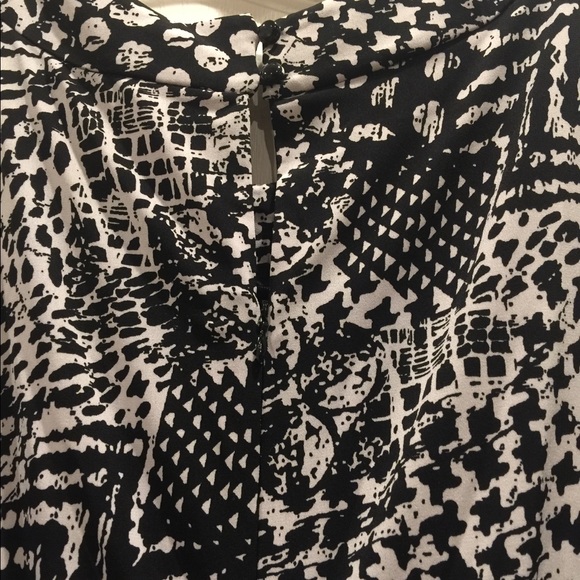
This screenshot has width=580, height=580. I want to click on textured black and white fabric, so tap(198, 443), tap(416, 466).